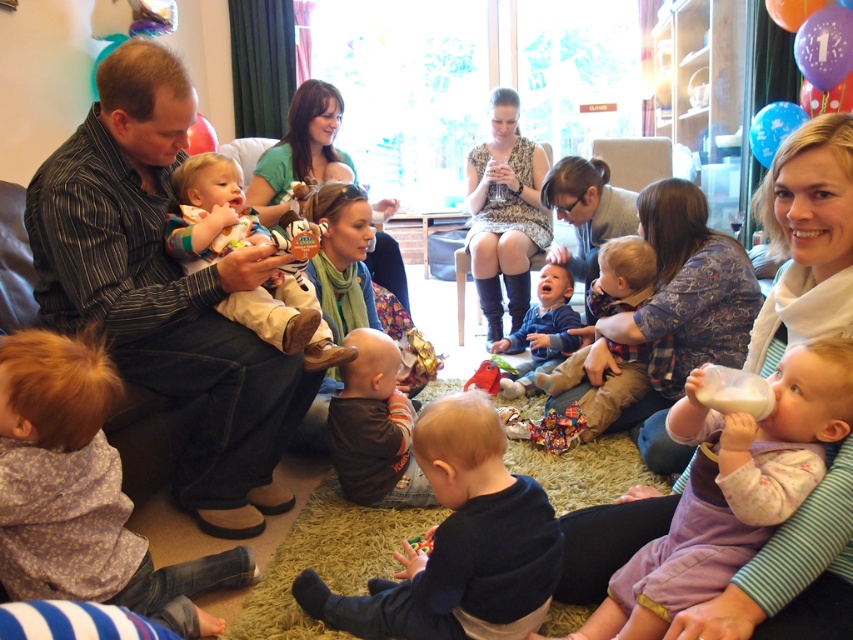
Question: Is striped shirt at left bigger than blue soft baby at center?

Choices:
 (A) yes
 (B) no

Answer: (A)

Question: Estimate the real-world distances between objects in this image. Which object is farther from the printed fabric dress at center?

Choices:
 (A) blue cotton shirt at center
 (B) blue soft baby at center

Answer: (A)

Question: Can you confirm if striped shirt at left is positioned to the left of printed fabric dress at center?

Choices:
 (A) yes
 (B) no

Answer: (A)

Question: Which point is farther to the camera?

Choices:
 (A) striped shirt at left
 (B) dark blue fabric at center

Answer: (A)

Question: Can you confirm if blue cotton shirt at center is positioned below green fabric scarf at center?

Choices:
 (A) no
 (B) yes

Answer: (B)

Question: Which of the following is the closest to the observer?

Choices:
 (A) green fabric scarf at center
 (B) blue cotton shirt at center
 (C) blue soft baby at center
 (D) printed fabric dress at center

Answer: (B)